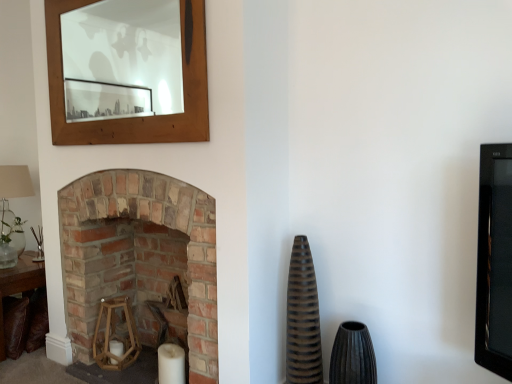
The image size is (512, 384). What do you see at coordinates (138, 255) in the screenshot? I see `brick fireplace at left` at bounding box center [138, 255].

This screenshot has height=384, width=512. In order to click on brick fireplace at left in this screenshot , I will do `click(138, 255)`.

Considering the sizes of translucent glass lampshade at left and brown leather table at lower left in the image, is translucent glass lampshade at left taller or shorter than brown leather table at lower left?

Considering their sizes, translucent glass lampshade at left has more height than brown leather table at lower left.

Can you confirm if translucent glass lampshade at left is thinner than brown leather table at lower left?

Yes, translucent glass lampshade at left is thinner than brown leather table at lower left.

Which is correct: translucent glass lampshade at left is inside brown leather table at lower left, or outside of it?

translucent glass lampshade at left cannot be found inside brown leather table at lower left.

Can you see translucent glass lampshade at left touching brown leather table at lower left?

No, translucent glass lampshade at left is not touching brown leather table at lower left.

Considering their positions, is brick fireplace at left located in front of or behind translucent glass lampshade at left?

brick fireplace at left is positioned closer to the viewer than translucent glass lampshade at left.

From the image's perspective, does brick fireplace at left appear higher than translucent glass lampshade at left?

No.

Is brick fireplace at left facing away from translucent glass lampshade at left?

No, translucent glass lampshade at left is not at the back of brick fireplace at left.

Is brown leather table at lower left not inside brown ribbed vase at center-right, the 1th vase viewed from the left?

Yes, brown leather table at lower left is outside of brown ribbed vase at center-right, the 1th vase viewed from the left.

Who is taller, brown leather table at lower left or brown ribbed vase at center-right, the 1th vase viewed from the left?

brown ribbed vase at center-right, the 1th vase viewed from the left, is taller.

Is brown leather table at lower left oriented away from brown ribbed vase at center-right, which is counted as the second vase, starting from the right?

No, brown leather table at lower left is not facing the opposite direction of brown ribbed vase at center-right, which is counted as the second vase, starting from the right.

From the image's perspective, does brown leather table at lower left appear higher than brown ribbed vase at center-right, which is counted as the second vase, starting from the right?

No.

Who is shorter, wooden frame at upper left or brown leather table at lower left?

With less height is brown leather table at lower left.

Is wooden frame at upper left looking in the opposite direction of brown leather table at lower left?

No, wooden frame at upper left is not facing the opposite direction of brown leather table at lower left.

Between wooden frame at upper left and brown leather table at lower left, which one is positioned behind?

brown leather table at lower left is further from the camera.

From a real-world perspective, is wooden frame at upper left physically below brown leather table at lower left?

No, from a real-world perspective, wooden frame at upper left is not under brown leather table at lower left.

Is there a large distance between wooden frame at upper left and matte brown vase at center-right, which ranks as the first vase in right-to-left order?

Yes, wooden frame at upper left and matte brown vase at center-right, which ranks as the first vase in right-to-left order, are quite far apart.

From the image's perspective, which is above, wooden frame at upper left or matte brown vase at center-right, which is counted as the second vase, starting from the left?

wooden frame at upper left.

Considering the positions of objects wooden frame at upper left and matte brown vase at center-right, which is counted as the second vase, starting from the left, in the image provided, who is more to the left, wooden frame at upper left or matte brown vase at center-right, which is counted as the second vase, starting from the left,?

wooden frame at upper left.

Which of these two, wooden frame at upper left or matte brown vase at center-right, which is counted as the second vase, starting from the left, is smaller?

matte brown vase at center-right, which is counted as the second vase, starting from the left, is smaller.

Is wooden frame at upper left to the left of wooden hexagonal candle holder at lower left from the viewer's perspective?

In fact, wooden frame at upper left is to the right of wooden hexagonal candle holder at lower left.

From the image's perspective, between wooden frame at upper left and wooden hexagonal candle holder at lower left, who is located below?

wooden hexagonal candle holder at lower left.

Considering the points (79, 81) and (133, 352), which point is behind, point (79, 81) or point (133, 352)?

The point (79, 81) is more distant.

Can you confirm if wooden frame at upper left is thinner than wooden hexagonal candle holder at lower left?

Correct, the width of wooden frame at upper left is less than that of wooden hexagonal candle holder at lower left.

Which is closer, [1,265] or [140,269]?

Clearly, point [1,265] is more distant from the camera than point [140,269].

From a real-world perspective, is translucent glass lampshade at left over brick fireplace at left?

Yes, from a real-world perspective, translucent glass lampshade at left is over brick fireplace at left

Which object is more forward, translucent glass lampshade at left or brick fireplace at left?

brick fireplace at left.

You are a GUI agent. You are given a task and a screenshot of the screen. Output one action in this format:
    pyautogui.click(x=<x>, y=<y>)
    Task: Click on the lamp that is on the left side of brown leather table at lower left
    This screenshot has width=512, height=384.
    Given the screenshot: What is the action you would take?
    pyautogui.click(x=11, y=211)

Where is `lamp above the brick fireplace at left (from the image's perspective)`? lamp above the brick fireplace at left (from the image's perspective) is located at coordinates (11, 211).

When comparing their distances from brick fireplace at left, does matte brown vase at center-right, which is counted as the second vase, starting from the left, or brown ribbed vase at center-right, the 1th vase viewed from the left, seem closer?

brown ribbed vase at center-right, the 1th vase viewed from the left, is closer to brick fireplace at left.

From the image, which object appears to be nearer to translucent glass lampshade at left, brick fireplace at left or brown leather table at lower left?

brown leather table at lower left is positioned closer to the anchor translucent glass lampshade at left.

Looking at the image, which one is located closer to brown ribbed vase at center-right, the 1th vase viewed from the left, brown leather table at lower left or matte brown vase at center-right, which ranks as the first vase in right-to-left order?

The object closer to brown ribbed vase at center-right, the 1th vase viewed from the left, is matte brown vase at center-right, which ranks as the first vase in right-to-left order.

Based on their spatial positions, is brown ribbed vase at center-right, which is counted as the second vase, starting from the right, or brown leather table at lower left further from wooden frame at upper left?

brown ribbed vase at center-right, which is counted as the second vase, starting from the right, is positioned further to the anchor wooden frame at upper left.

From the image, which object appears to be farther from brown leather table at lower left, translucent glass lampshade at left or brown ribbed vase at center-right, the 1th vase viewed from the left?

The object further to brown leather table at lower left is brown ribbed vase at center-right, the 1th vase viewed from the left.

Looking at the image, which one is located closer to brown leather table at lower left, translucent glass lampshade at left or wooden frame at upper left?

translucent glass lampshade at left lies closer to brown leather table at lower left than the other object.

From the image, which object appears to be nearer to matte brown vase at center-right, which ranks as the first vase in right-to-left order, wooden hexagonal candle holder at lower left or translucent glass lampshade at left?

wooden hexagonal candle holder at lower left is closer to matte brown vase at center-right, which ranks as the first vase in right-to-left order.

When comparing their distances from brick fireplace at left, does brown leather table at lower left or translucent glass lampshade at left seem closer?

The object closer to brick fireplace at left is brown leather table at lower left.

Identify the location of candle holder situated between brown leather table at lower left and brick fireplace at left from left to right. (115, 335).

Where is `vase between translucent glass lampshade at left and matte brown vase at center-right, which is counted as the second vase, starting from the left, in the horizontal direction`? vase between translucent glass lampshade at left and matte brown vase at center-right, which is counted as the second vase, starting from the left, in the horizontal direction is located at coordinates (303, 318).

This screenshot has width=512, height=384. Identify the location of fireplace between wooden frame at upper left and brown ribbed vase at center-right, which is counted as the second vase, starting from the right, vertically. (138, 255).

The height and width of the screenshot is (384, 512). I want to click on table between translucent glass lampshade at left and brick fireplace at left in the horizontal direction, so click(x=19, y=285).